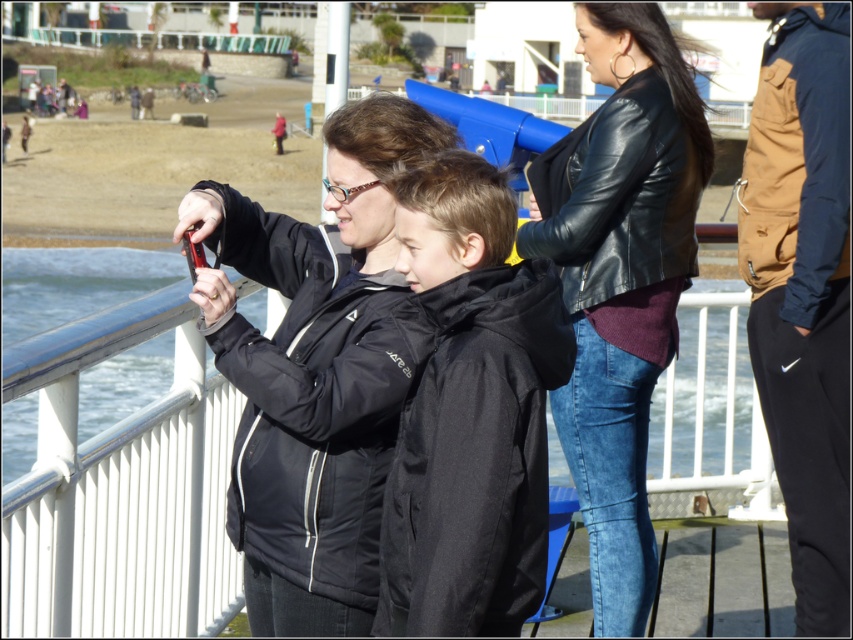
What are the coordinates of the black matte jacket at center?

The coordinates of the black matte jacket at center are at point (469, 412).

You are standing at the point marked as point (315, 372) in the image. What object is located exactly at this point?

The matte black jacket at center is located exactly at point (315, 372).